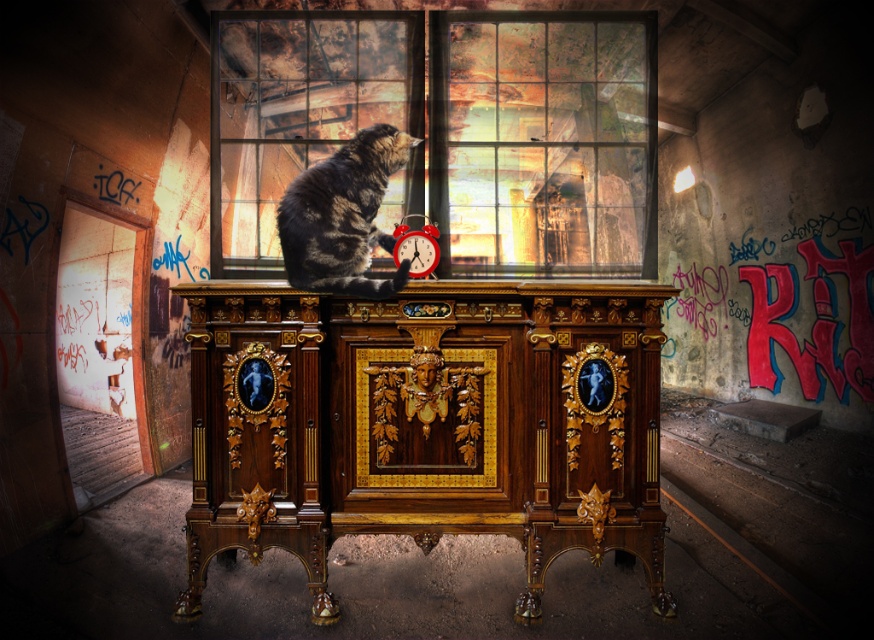
You are an interior designer planning to place a new decorative item on the cabinet. The item is 15 cm wide. You see the glass pane at center and the red alarm clock at center. Which object can the new item fit next to without overlapping?

The glass pane at center has a greater width than the red alarm clock at center. Since the new item is 15 cm wide, it can fit next to either object, but the glass pane at center offers more space due to its wider width.

You are standing in the abandoned room and want to place a small plant between the two points marked as point [351,115] and point [421,276]. Which point should the plant be closer to in order to be positioned between them?

The plant should be closer to point [421,276] because point [351,115] is behind it, so placing the plant closer to the front point ensures it is between them.

You are a cat owner who wants to ensure your cat stays safe indoors. You notice your tabby fur cat at center is near a clear glass window at center. Based on their positions, is there a risk the cat might accidentally knock over the window?

The clear glass window at center is above the tabby fur cat at center, so the cat cannot reach it. There is no risk of the cat knocking over the window.